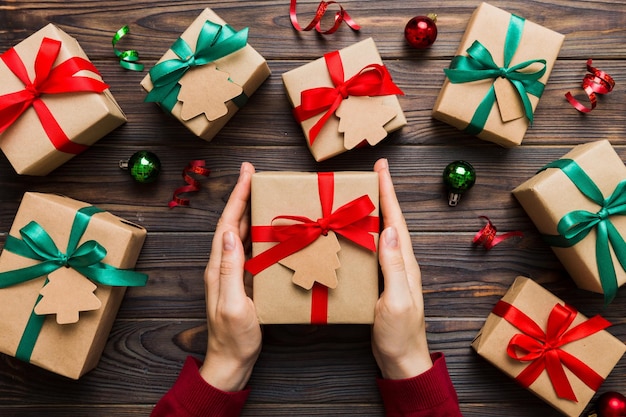
Find the location of a particular element. Image resolution: width=626 pixels, height=417 pixels. knot of red bow is located at coordinates (33, 90), (342, 91), (322, 228), (552, 346).